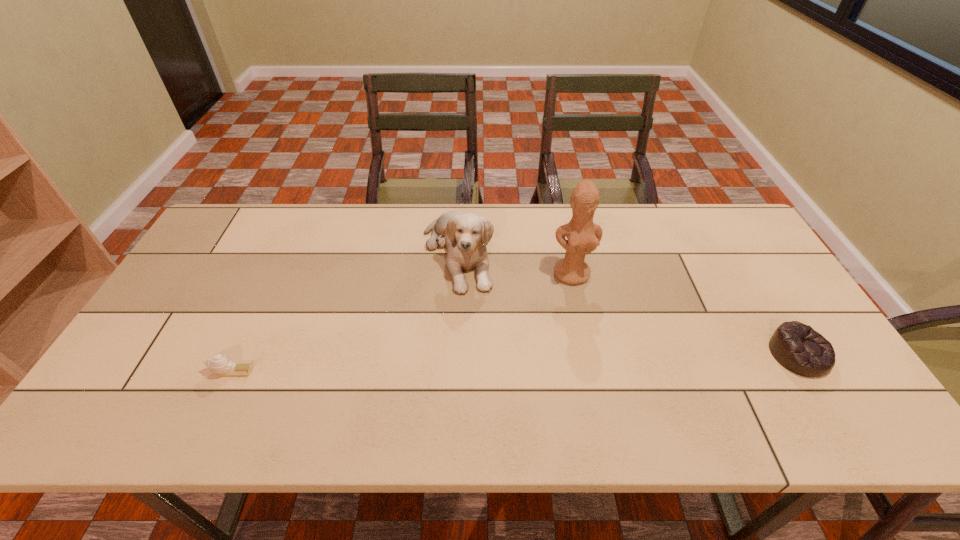
Where is `vacant space that's between the second object from right to left and the puppy`? vacant space that's between the second object from right to left and the puppy is located at coordinates (515, 264).

Where is `vacant region between the beanbag and the second object from right to left`? vacant region between the beanbag and the second object from right to left is located at coordinates tap(685, 314).

Where is `vacant area that lies between the leftmost object and the tallest object`? The width and height of the screenshot is (960, 540). vacant area that lies between the leftmost object and the tallest object is located at coordinates (402, 322).

The height and width of the screenshot is (540, 960). I want to click on empty space between the second object from left to right and the tallest object, so click(515, 264).

The width and height of the screenshot is (960, 540). Find the location of `free space between the second tallest object and the second object from right to left`. free space between the second tallest object and the second object from right to left is located at coordinates (515, 264).

Image resolution: width=960 pixels, height=540 pixels. What are the coordinates of `vacant space that is in between the third tallest object and the shortest object` in the screenshot? It's located at (516, 362).

The image size is (960, 540). What are the coordinates of `blank region between the second shortest object and the second object from left to right` in the screenshot? It's located at (628, 305).

Find the location of `empty space between the rightmost object and the tallest object`. empty space between the rightmost object and the tallest object is located at coordinates (685, 314).

You are a GUI agent. You are given a task and a screenshot of the screen. Output one action in this format:
    pyautogui.click(x=<x>, y=<y>)
    Task: Click on the free space between the third object from left to right and the second tallest object
    
    Given the screenshot: What is the action you would take?
    pyautogui.click(x=515, y=264)

Identify which object is the nearest to the second object from left to right. Please provide its 2D coordinates. Your answer should be formatted as a tuple, i.e. [(x, y)], where the tuple contains the x and y coordinates of a point satisfying the conditions above.

[(583, 236)]